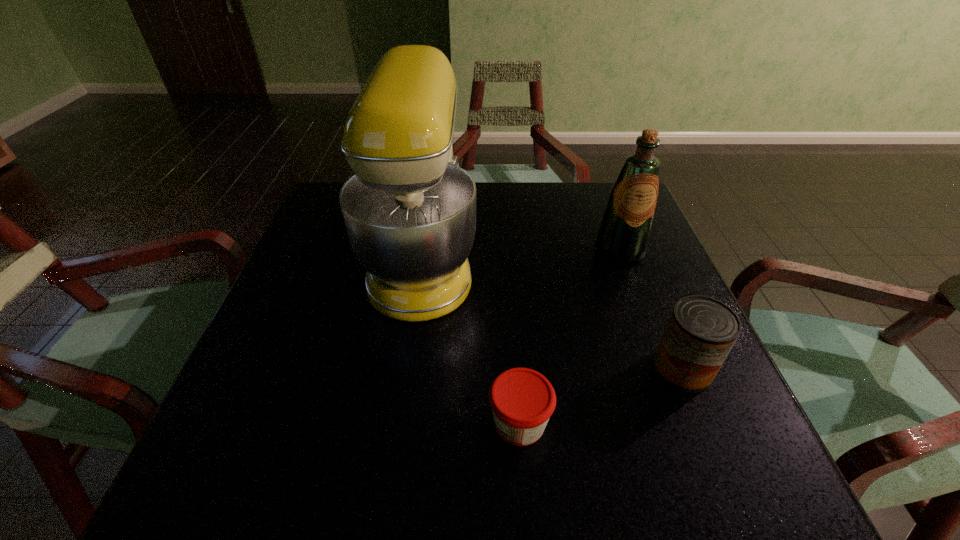
Where is `vacant region located on the label side of the nearest object`? vacant region located on the label side of the nearest object is located at coordinates (277, 422).

Find the location of a particular element. vacant space situated on the label side of the nearest object is located at coordinates (364, 422).

Locate an element on the screen. free region located on the label side of the nearest object is located at coordinates (407, 422).

Find the location of a particular element. Image resolution: width=960 pixels, height=540 pixels. object present at the far edge is located at coordinates (410, 211).

The height and width of the screenshot is (540, 960). I want to click on object located in the near edge section of the desktop, so click(522, 400).

Image resolution: width=960 pixels, height=540 pixels. I want to click on olive oil that is at the right edge, so click(623, 237).

Locate an element on the screen. can that is at the right edge is located at coordinates (701, 331).

At what (x,y) coordinates should I click in order to perform the action: click on vacant area at the far edge. Please return your answer as a coordinate pair (x, y). The image size is (960, 540). Looking at the image, I should click on (548, 192).

Locate an element on the screen. This screenshot has height=540, width=960. free space at the near edge of the desktop is located at coordinates (309, 495).

Locate an element on the screen. Image resolution: width=960 pixels, height=540 pixels. free space at the left edge is located at coordinates (296, 292).